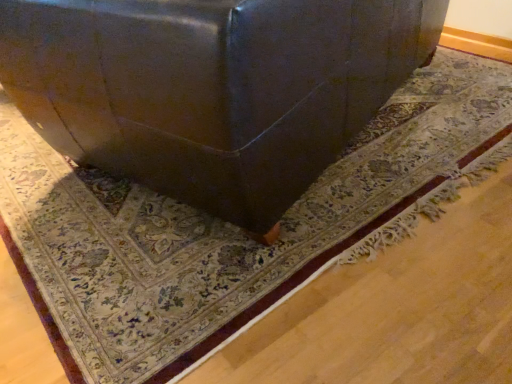
The image size is (512, 384). Identify the location of matte leather couch at center. (212, 89).

What do you see at coordinates (212, 89) in the screenshot?
I see `matte leather couch at center` at bounding box center [212, 89].

In order to face matte leather couch at center, should I rotate leftwards or rightwards?

Turn right by 1.646 degrees to look at matte leather couch at center.

Measure the distance between point (x=66, y=75) and camera.

The depth of point (x=66, y=75) is 3.72 feet.

This screenshot has height=384, width=512. I want to click on matte leather couch at center, so click(212, 89).